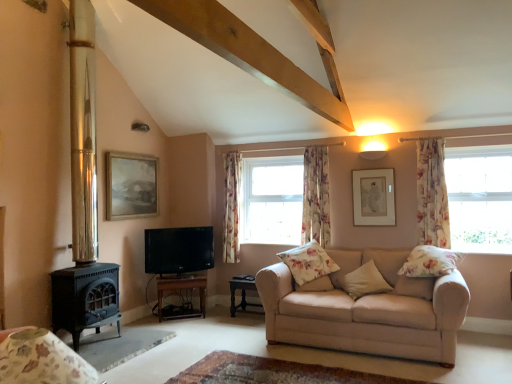
Find the location of a particular element. This screenshot has width=512, height=384. blank space situated above floral fabric curtain at center, placed as the second curtain when sorted from left to right (from a real-world perspective) is located at coordinates [316, 145].